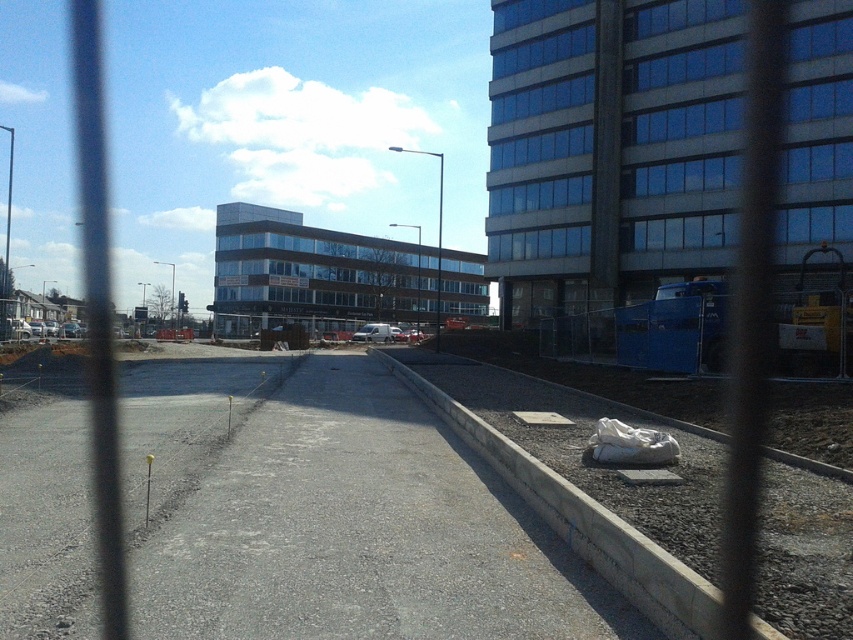
Question: Which point appears farthest from the camera in this image?

Choices:
 (A) (808, 483)
 (B) (525, 150)

Answer: (B)

Question: Can you confirm if concrete at right is positioned to the right of glassy brown building at center?

Choices:
 (A) no
 (B) yes

Answer: (B)

Question: Does concrete at right have a greater width compared to glassy brown building at center?

Choices:
 (A) no
 (B) yes

Answer: (A)

Question: Which point is farther from the camera taking this photo?

Choices:
 (A) (341, 248)
 (B) (624, 42)

Answer: (A)

Question: Which object is closer to the camera taking this photo?

Choices:
 (A) concrete at right
 (B) glassy blue building at upper right
 (C) glassy brown building at center

Answer: (A)

Question: Is glassy blue building at upper right further to camera compared to concrete at right?

Choices:
 (A) no
 (B) yes

Answer: (B)